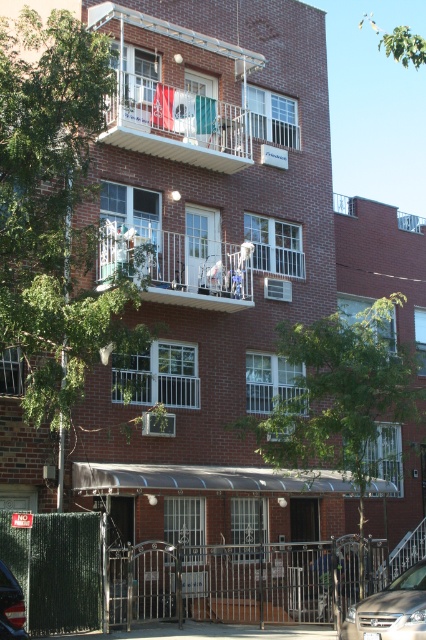
In the scene shown: Is white plastic balcony at upper center thinner than white plastic laundry at center?

No, white plastic balcony at upper center is not thinner than white plastic laundry at center.

The image size is (426, 640). What do you see at coordinates (176, 124) in the screenshot? I see `white plastic balcony at upper center` at bounding box center [176, 124].

This screenshot has height=640, width=426. Identify the location of white plastic balcony at upper center. (176, 124).

Who is higher up, white plastic laundry at center or silver metallic sedan at center?

Positioned higher is white plastic laundry at center.

Is point (170, 234) positioned after point (400, 621)?

Yes, point (170, 234) is farther from viewer.

Who is more distant from viewer, (160, 241) or (397, 636)?

Positioned behind is point (160, 241).

Image resolution: width=426 pixels, height=640 pixels. I want to click on white plastic laundry at center, so click(178, 266).

Measure the distance between silver metallic sedan at center and camera.

silver metallic sedan at center and camera are 14.62 meters apart from each other.

Is silver metallic sedan at center smaller than shiny blue car at lower left?

No.

Does point (417, 566) come farther from viewer compared to point (9, 618)?

Yes, point (417, 566) is farther from viewer.

This screenshot has width=426, height=640. Find the location of `silver metallic sedan at center`. silver metallic sedan at center is located at coordinates (391, 609).